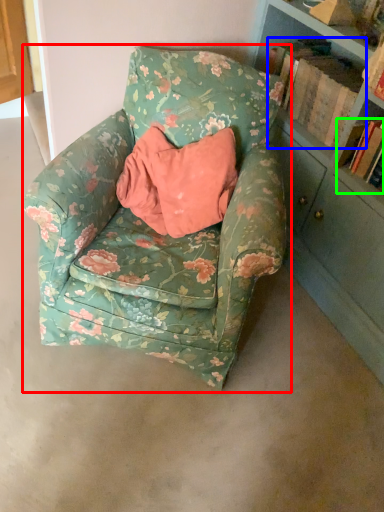
Question: Estimate the real-world distances between objects in this image. Which object is closer to chair (highlighted by a red box), book (highlighted by a blue box) or book (highlighted by a green box)?

Choices:
 (A) book
 (B) book

Answer: (A)